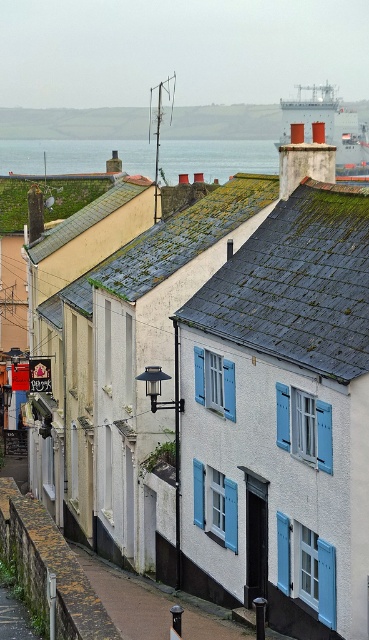
You are a tourist standing at the bottom of the sloping street looking up. You see the smooth concrete wall at upper center and the metallic gray ship at upper center. Which object is taller?

The smooth concrete wall at upper center is not as tall as the metallic gray ship at upper center, so the metallic gray ship at upper center is taller.